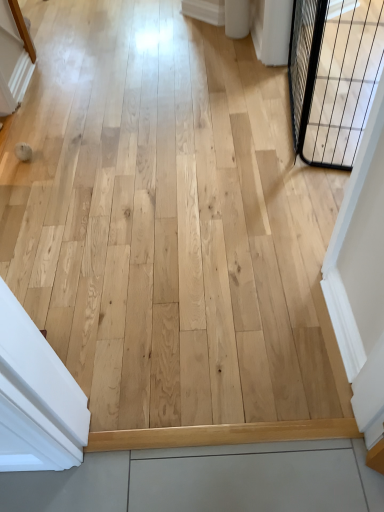
What do you see at coordinates (334, 76) in the screenshot?
I see `clear glass gate at right` at bounding box center [334, 76].

This screenshot has width=384, height=512. Identify the location of clear glass gate at right. (334, 76).

In order to click on clear glass gate at right in this screenshot , I will do `click(334, 76)`.